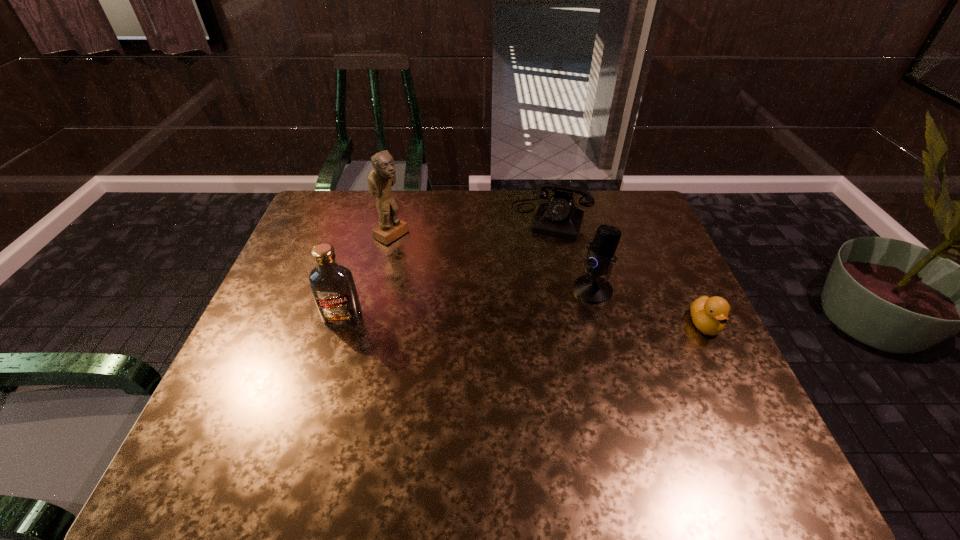
The image size is (960, 540). I want to click on free spot on the desktop that is between the vodka and the rightmost object and is positioned on the front face of the telephone, so click(514, 321).

Where is `vacant space on the desktop that is between the vodka and the rightmost object and is positioned on the front-facing side of the tallest object`? Image resolution: width=960 pixels, height=540 pixels. vacant space on the desktop that is between the vodka and the rightmost object and is positioned on the front-facing side of the tallest object is located at coordinates coord(557,321).

The image size is (960, 540). Find the location of `vacant space on the desktop that is between the vodka and the duckling and is positioned on the stand of the microphone`. vacant space on the desktop that is between the vodka and the duckling and is positioned on the stand of the microphone is located at coordinates (526, 321).